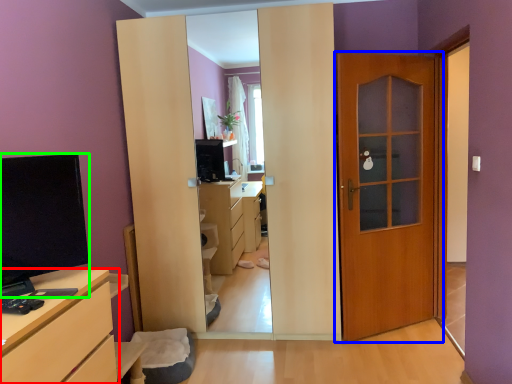
Question: Which object is the farthest from chest of drawers (highlighted by a red box)? Choose among these: door (highlighted by a blue box) or open (highlighted by a green box).

Choices:
 (A) door
 (B) open

Answer: (A)